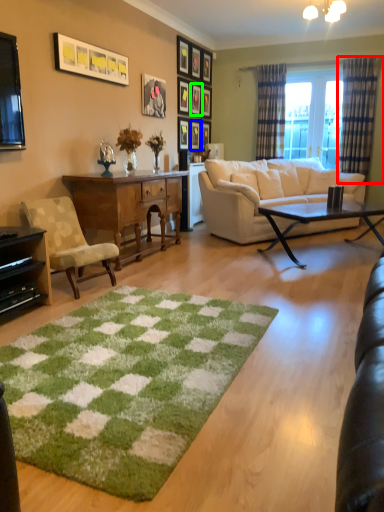
Question: Based on their relative distances, which object is nearer to curtain (highlighted by a red box)? Choose from picture frame (highlighted by a blue box) and picture frame (highlighted by a green box).

Choices:
 (A) picture frame
 (B) picture frame

Answer: (B)